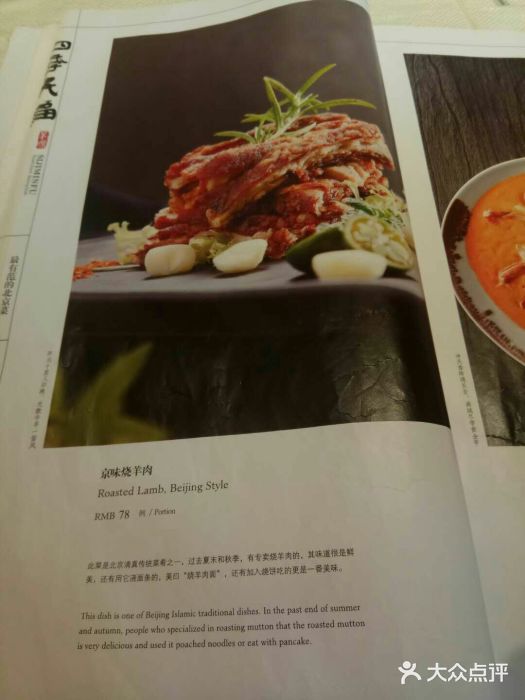
Find the location of a particular element. This screenshot has width=525, height=700. white table is located at coordinates (35, 7), (423, 8).